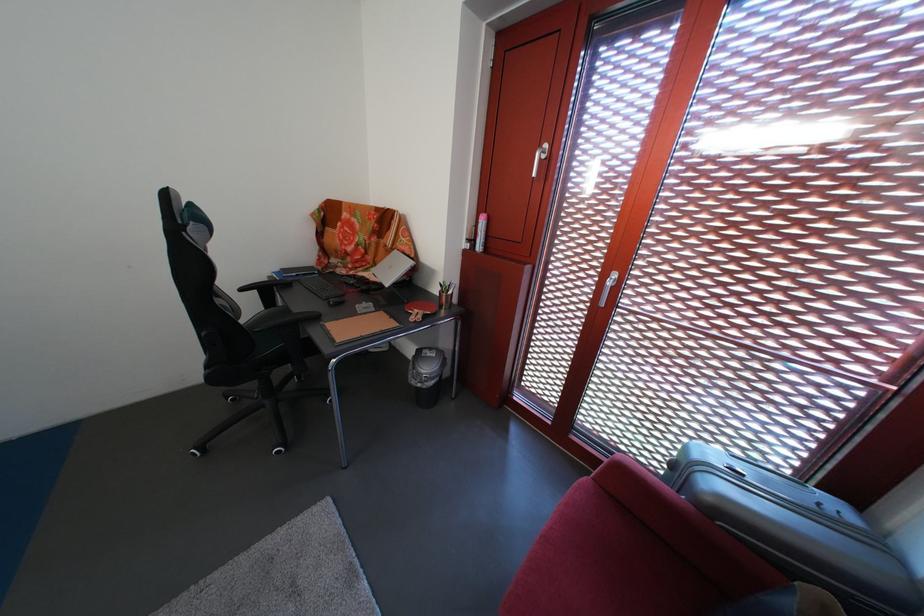
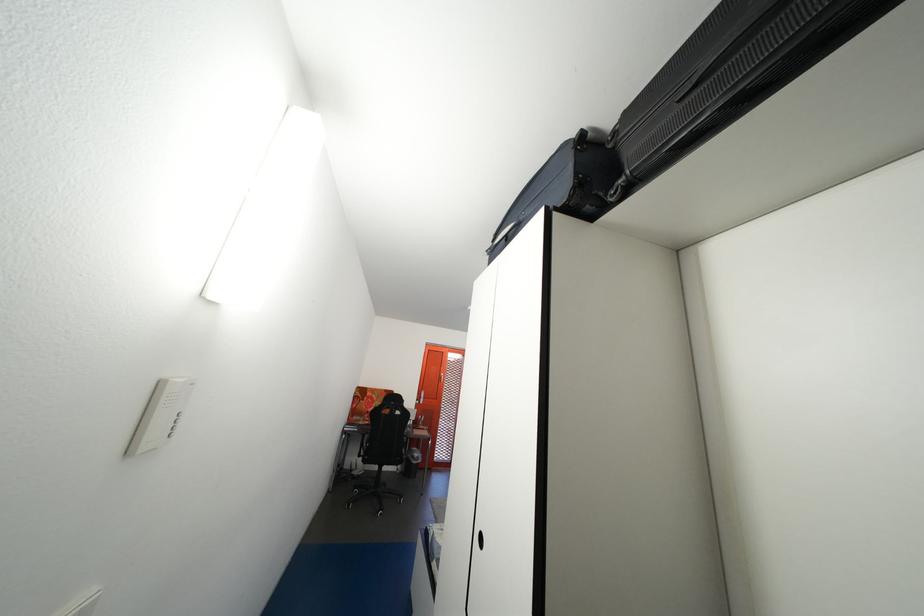
Question: I am providing you with two images of the same scene from different viewpoints. After the viewpoint changes to image2, which objects are now occluded?

Choices:
 (A) black recessed handle
 (B) orange shaker bottle
 (C) red sofa armrest
 (D) orange door handle

Answer: (C)